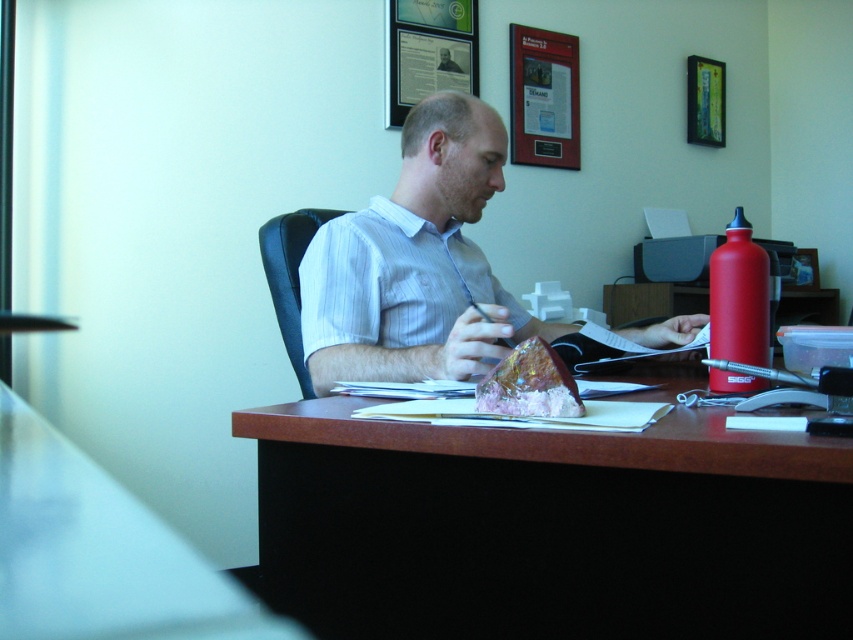
Who is positioned more to the right, metallic framed poster at upper center or translucent pink crystal at desk center?

From the viewer's perspective, metallic framed poster at upper center appears more on the right side.

Which is below, metallic framed poster at upper center or translucent pink crystal at desk center?

translucent pink crystal at desk center is below.

Does point (529, 112) come farther from viewer compared to point (527, 346)?

Yes, point (529, 112) is behind point (527, 346).

Identify the location of metallic framed poster at upper center. (543, 97).

Is the position of wooden desk at lower center more distant than that of translucent pink crystal at desk center?

Yes, wooden desk at lower center is behind translucent pink crystal at desk center.

Identify the location of wooden desk at lower center. The width and height of the screenshot is (853, 640). (99, 552).

Is wooden desk at lower center wider than metallic framed poster at upper center?

Yes, wooden desk at lower center is wider than metallic framed poster at upper center.

Between wooden desk at lower center and metallic framed poster at upper center, which one is positioned higher?

metallic framed poster at upper center is above.

Which is behind, point (79, 492) or point (527, 154)?

Point (527, 154)

Find the location of a particular element. wooden desk at lower center is located at coordinates coord(99,552).